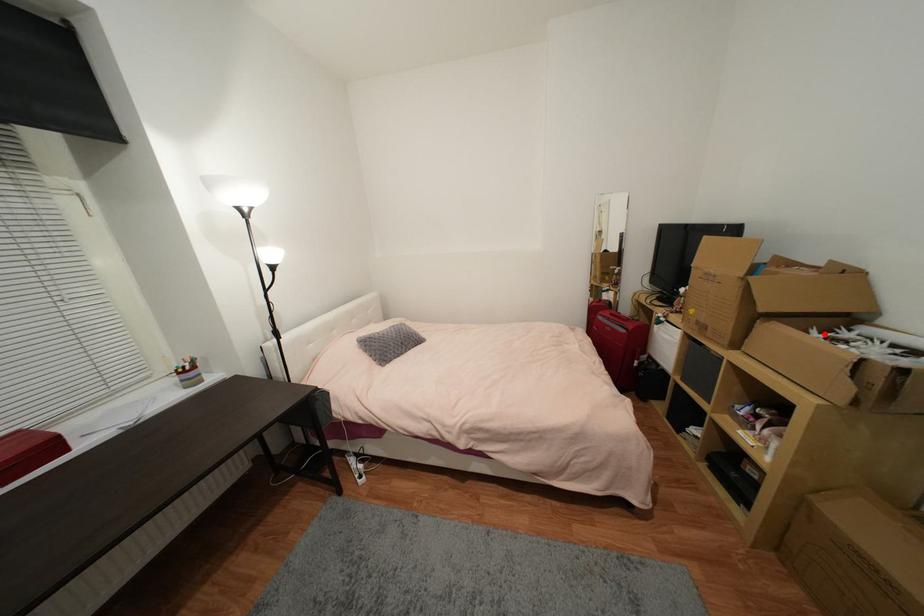
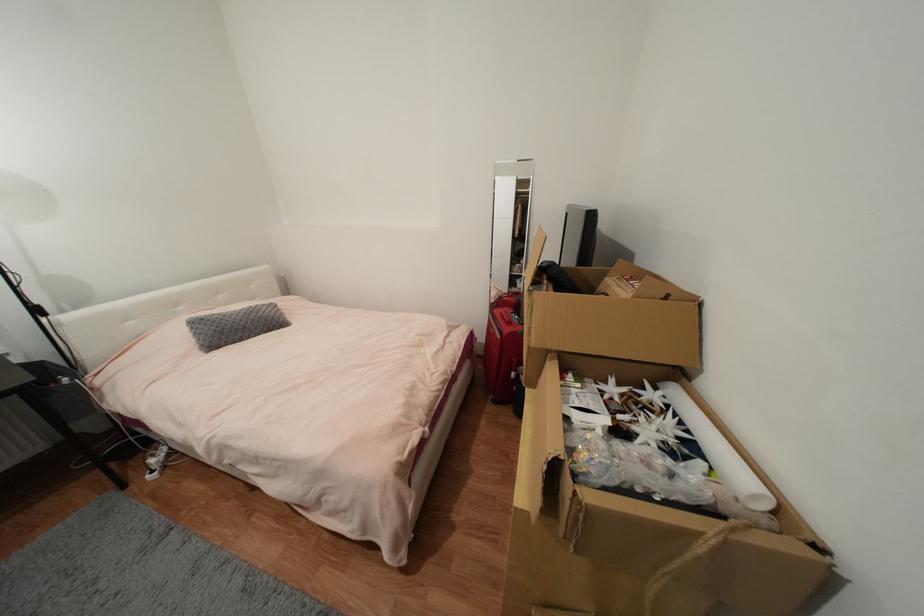
Find the pixel in the second image that matches the highlighted location in the first image.

(624, 386)